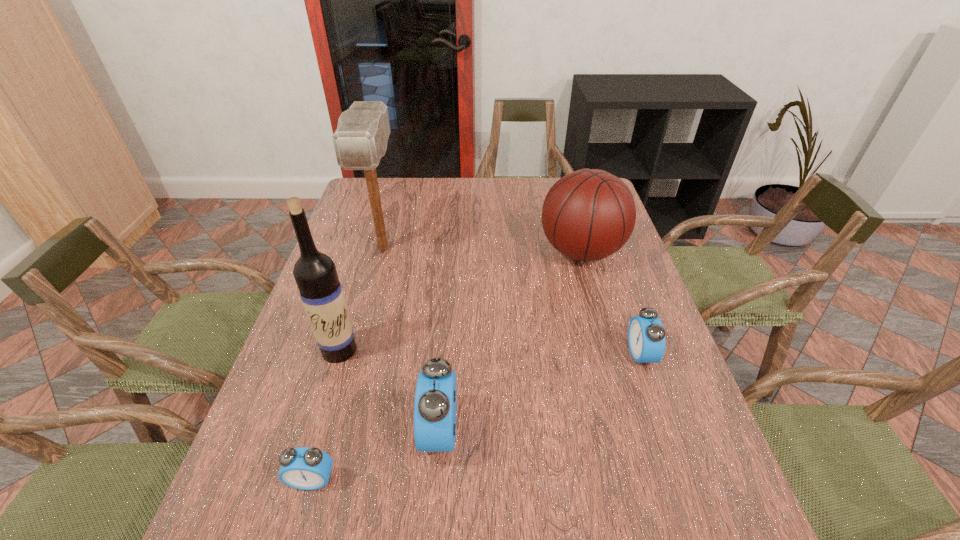
In order to click on wine bottle that is positioned at the left edge in this screenshot , I will do `click(315, 273)`.

Locate an element on the screen. alarm clock located in the right edge section of the desktop is located at coordinates (646, 336).

Find the location of a particular element. basketball that is at the right edge is located at coordinates (589, 214).

Image resolution: width=960 pixels, height=540 pixels. Find the location of `object at the near left corner`. object at the near left corner is located at coordinates (304, 468).

Identify the location of vacant region at the far edge of the desktop. The width and height of the screenshot is (960, 540). (504, 191).

Locate an element on the screen. The image size is (960, 540). free space at the left edge of the desktop is located at coordinates (362, 281).

At what (x,y) coordinates should I click in order to perform the action: click on free space at the right edge. Please return your answer as a coordinate pair (x, y). This screenshot has width=960, height=540. Looking at the image, I should click on (620, 289).

In the image, there is a desktop. Find the location of `vacant space at the near left corner`. vacant space at the near left corner is located at coordinates (248, 468).

The image size is (960, 540). Identify the location of free space that is in between the wine bottle and the fourth tallest object. (390, 390).

Locate an element on the screen. This screenshot has height=540, width=960. vacant region between the second alarm clock from left to right and the mallet is located at coordinates (412, 340).